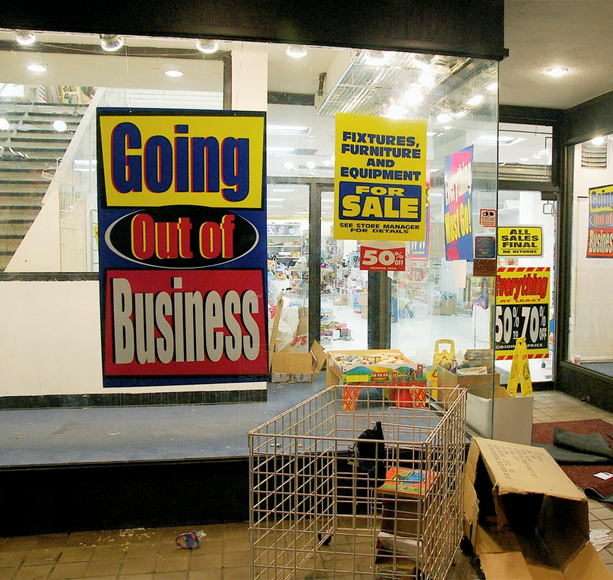
At what (x,y) coordinates should I click in order to perform the action: click on light. Please return your answer as a coordinate pair (x, y). The image size is (613, 580). Looking at the image, I should click on (557, 71).